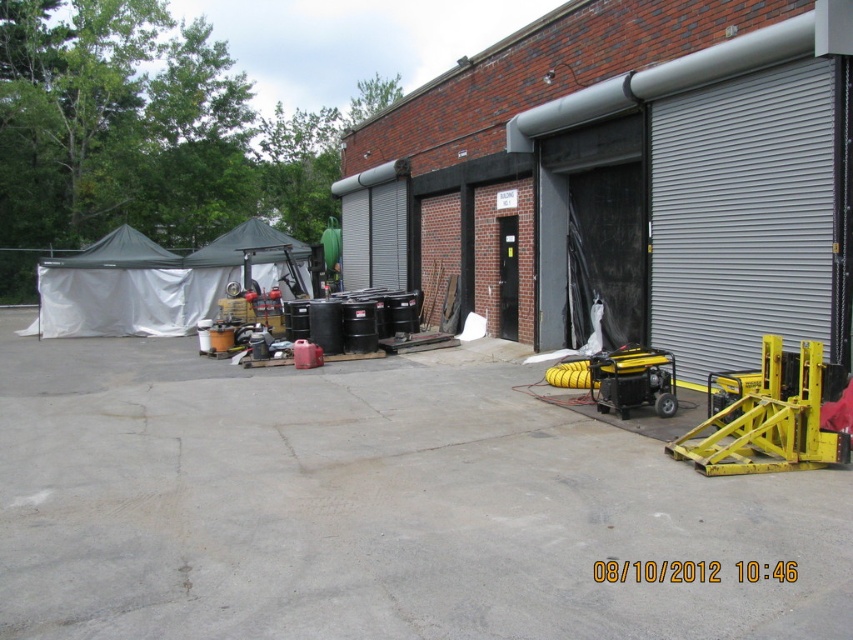
Question: Which object is the closest to the yellow metallic forklift at right?

Choices:
 (A) gray metallic garage door at right
 (B) yellow metallic generator at lower right

Answer: (B)

Question: Is metallic gray shed at center positioned at the back of yellow metallic forklift at right?

Choices:
 (A) yes
 (B) no

Answer: (A)

Question: Is metallic gray shed at center thinner than yellow metallic generator at lower right?

Choices:
 (A) yes
 (B) no

Answer: (B)

Question: Is yellow metallic forklift at right closer to the viewer compared to yellow metallic generator at lower right?

Choices:
 (A) yes
 (B) no

Answer: (A)

Question: Among these objects, which one is nearest to the camera?

Choices:
 (A) yellow metallic forklift at right
 (B) gray metallic garage door at right

Answer: (A)

Question: Which point is closer to the camera?

Choices:
 (A) click(708, 305)
 (B) click(634, 346)

Answer: (B)